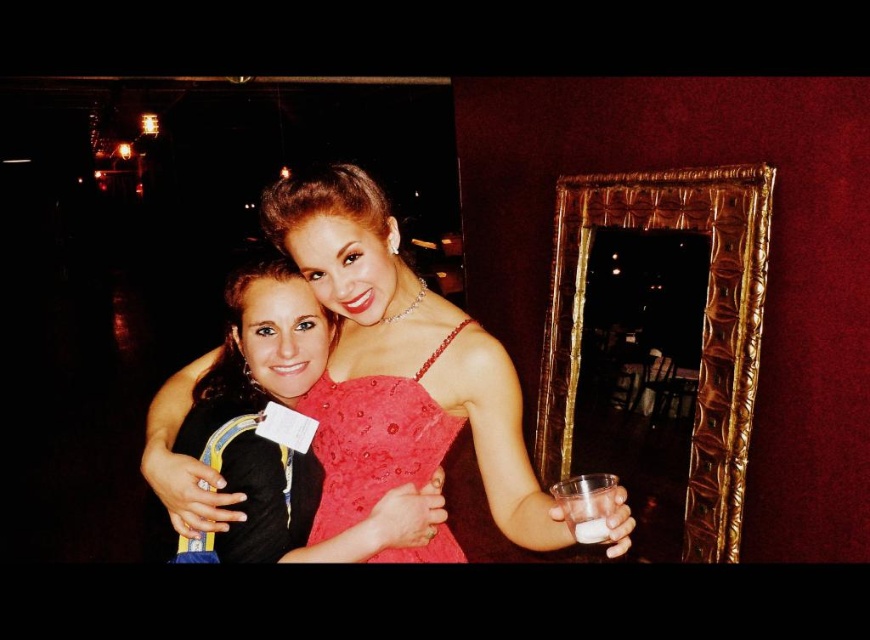
You are at a party and want to grab a drink from the table where the clear plastic cup at right and the translucent glass cup at center are placed. Which cup can you reach first if you approach from the front?

The clear plastic cup at right can be reached first because it is in front of the translucent glass cup at center, making it more accessible when approaching from the front.

You are at a party and need to pour a drink into the tallest cup available. Which cup should you choose between the clear plastic cup at right and the translucent glass cup at center?

The clear plastic cup at right is taller than the translucent glass cup at center, so you should choose the clear plastic cup at right.

Based on the photo, you are at a party and want to grab the clear plastic cup at right without touching the shiny satin dress at center. Is there enough space between them?

The shiny satin dress at center is to the left of the clear plastic cup at right, so there is space between them. You can reach the clear plastic cup at right without touching the shiny satin dress at center.